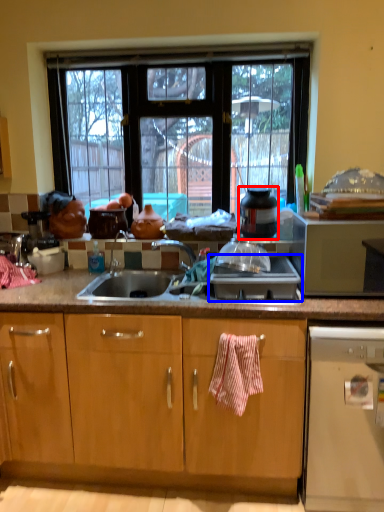
Question: Which point is further to the camera, appliance (highlighted by a red box) or gas stove (highlighted by a blue box)?

Choices:
 (A) appliance
 (B) gas stove

Answer: (A)